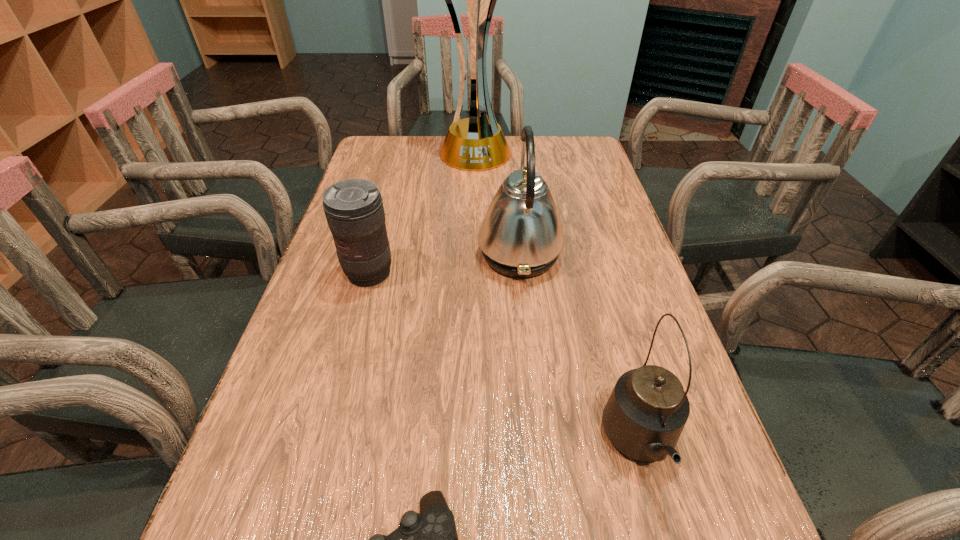
Where is `free space located from the spout of the taller kettle`? This screenshot has height=540, width=960. free space located from the spout of the taller kettle is located at coordinates (437, 254).

The width and height of the screenshot is (960, 540). Find the location of `vacant point located from the spout of the taller kettle`. vacant point located from the spout of the taller kettle is located at coordinates (437, 254).

This screenshot has width=960, height=540. In order to click on vacant region located 0.130m on the side of the second shortest object where the control switches are located in this screenshot , I will do `click(351, 337)`.

The height and width of the screenshot is (540, 960). I want to click on object present at the far edge, so click(476, 143).

Where is `object positioned at the left edge`? Image resolution: width=960 pixels, height=540 pixels. object positioned at the left edge is located at coordinates (354, 210).

The image size is (960, 540). In order to click on object located at the right edge in this screenshot , I will do `click(648, 408)`.

Image resolution: width=960 pixels, height=540 pixels. Find the location of `free space at the far edge of the desktop`. free space at the far edge of the desktop is located at coordinates (430, 143).

Where is `vacant space at the left edge`? The height and width of the screenshot is (540, 960). vacant space at the left edge is located at coordinates (348, 341).

Image resolution: width=960 pixels, height=540 pixels. I want to click on vacant space at the right edge of the desktop, so click(708, 475).

Image resolution: width=960 pixels, height=540 pixels. In order to click on free location at the far right corner of the desktop in this screenshot , I will do `click(560, 143)`.